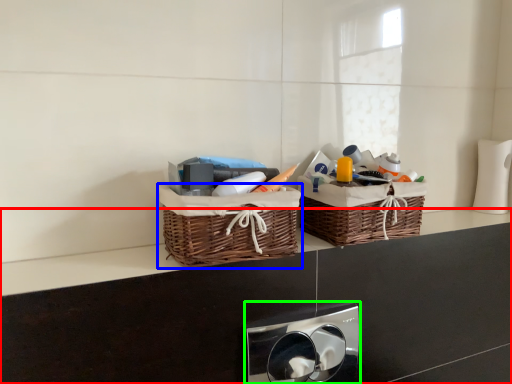
Question: Estimate the real-world distances between objects in this image. Which object is farther from counter (highlighted by a red box), picnic basket (highlighted by a blue box) or appliance (highlighted by a green box)?

Choices:
 (A) picnic basket
 (B) appliance

Answer: (B)